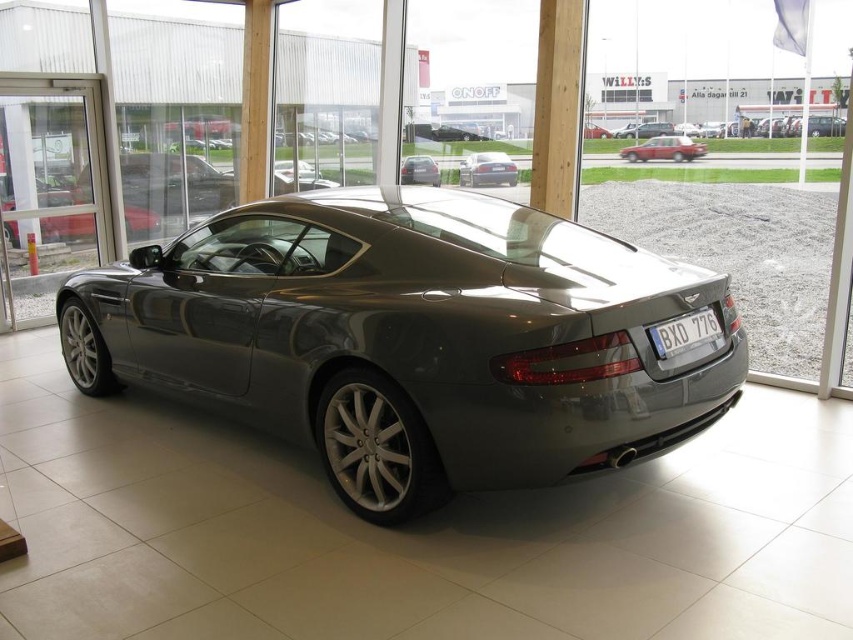
Between satin metallic car at center and white plastic license plate at rear, which one appears on the left side from the viewer's perspective?

From the viewer's perspective, satin metallic car at center appears more on the left side.

At what (x,y) coordinates should I click in order to perform the action: click on satin metallic car at center. Please return your answer as a coordinate pair (x, y). This screenshot has height=640, width=853. Looking at the image, I should click on (415, 337).

Is point (686, 344) behind point (432, 180)?

No, (686, 344) is closer to viewer.

Does white plastic license plate at rear have a smaller size compared to satin black sedan at center?

Actually, white plastic license plate at rear might be larger than satin black sedan at center.

Who is more distant from viewer, (677, 339) or (410, 168)?

Point (410, 168)

Locate an element on the screen. The image size is (853, 640). white plastic license plate at rear is located at coordinates (683, 332).

Identify the location of satin silver sedan at center. (486, 170).

Does satin silver sedan at center come in front of metallic red sedan at center?

No.

The width and height of the screenshot is (853, 640). I want to click on satin silver sedan at center, so click(486, 170).